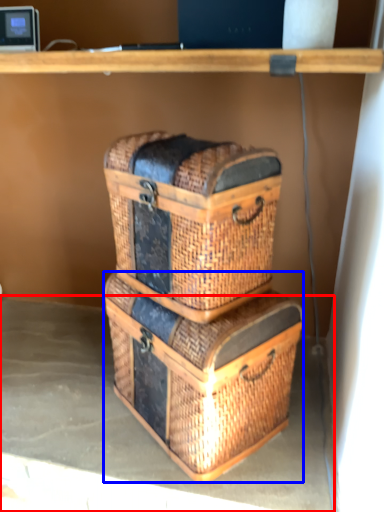
Question: Which point is further to the camera, concrete (highlighted by a red box) or crate (highlighted by a blue box)?

Choices:
 (A) concrete
 (B) crate

Answer: (A)